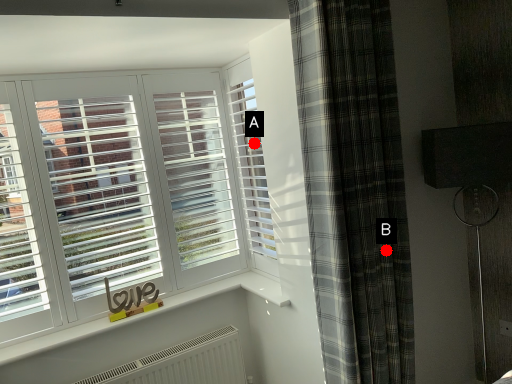
Question: Two points are circled on the image, labeled by A and B beside each circle. Which point is closer to the camera?

Choices:
 (A) A is closer
 (B) B is closer

Answer: (B)